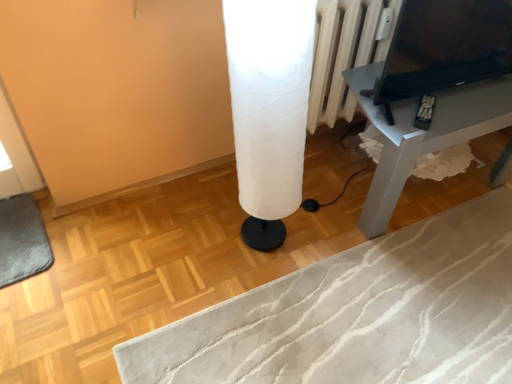
Question: Choose the correct answer: Is white fabric lampshade at center inside black glossy tv at upper right or outside it?

Choices:
 (A) outside
 (B) inside

Answer: (A)

Question: From a real-world perspective, is white fabric lampshade at center physically located above or below black glossy tv at upper right?

Choices:
 (A) above
 (B) below

Answer: (B)

Question: Which object is positioned farthest from the matte gray table at right?

Choices:
 (A) black glossy tv at upper right
 (B) white fabric lampshade at center

Answer: (B)

Question: Based on their relative distances, which object is nearer to the white fabric lampshade at center?

Choices:
 (A) black glossy tv at upper right
 (B) matte gray table at right

Answer: (B)